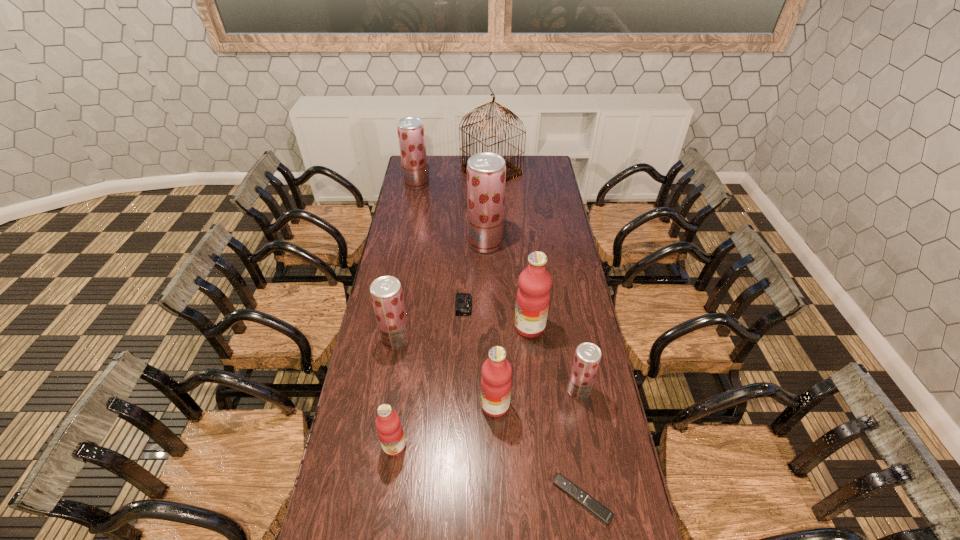
The image size is (960, 540). I want to click on the smallest strawberry fruit juice, so click(587, 357).

Find the location of `the nearest strawberry fruit juice`. the nearest strawberry fruit juice is located at coordinates [x=587, y=357].

I want to click on the ninth farthest object, so click(389, 428).

Where is `the leftmost pink fruit juice`? The height and width of the screenshot is (540, 960). the leftmost pink fruit juice is located at coordinates (389, 428).

Find the location of a particular element. The image size is (960, 540). the second shortest object is located at coordinates (463, 304).

Image resolution: width=960 pixels, height=540 pixels. I want to click on remote control, so click(x=588, y=502).

Where is `the shortest object`? The height and width of the screenshot is (540, 960). the shortest object is located at coordinates (588, 502).

This screenshot has height=540, width=960. Identify the location of free spot located on the front of the birdcage. (492, 206).

Image resolution: width=960 pixels, height=540 pixels. In order to click on free location located on the left of the biggest strawberry fruit juice in this screenshot , I will do `click(398, 243)`.

The height and width of the screenshot is (540, 960). What are the coordinates of `free spot located 0.260m on the back of the second biggest strawberry fruit juice` in the screenshot? It's located at (422, 156).